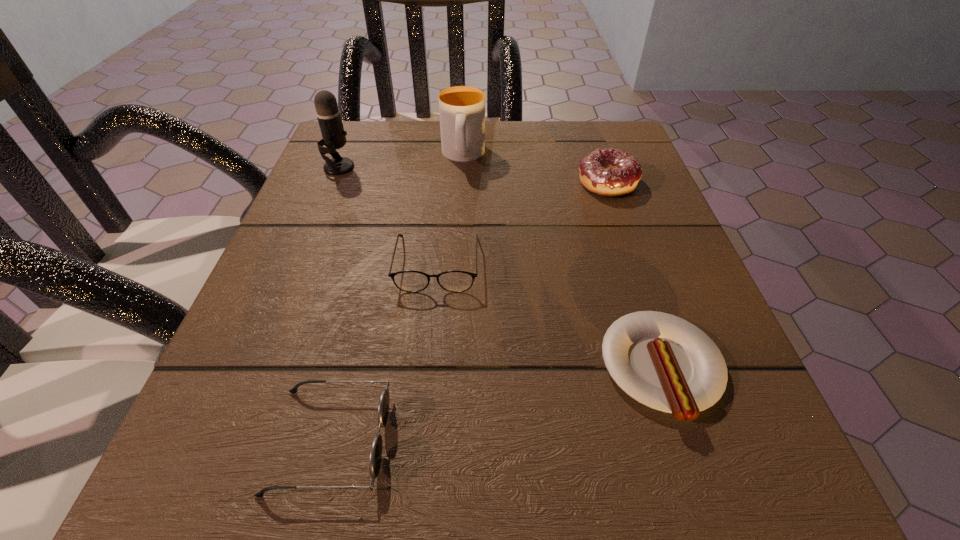
Where is `microphone`? This screenshot has height=540, width=960. microphone is located at coordinates (328, 114).

Identify the location of the tallest object. (328, 114).

This screenshot has width=960, height=540. Find the location of `cup`. cup is located at coordinates (461, 108).

The height and width of the screenshot is (540, 960). Identify the location of doughnut. (608, 172).

Where is `spectacles`? This screenshot has width=960, height=540. spectacles is located at coordinates (412, 281).

The image size is (960, 540). What are the coordinates of `sunglasses` in the screenshot? It's located at (375, 458).

Image resolution: width=960 pixels, height=540 pixels. What are the coordinates of `sausage` in the screenshot? It's located at (662, 361).

The image size is (960, 540). Identify the location of free location located 0.140m on the right of the leftmost object. (423, 167).

I want to click on blank space located 0.240m with the handle on the side of the cup, so coord(458,259).

Where is `vacant space located 0.190m on the left of the doughnut`? vacant space located 0.190m on the left of the doughnut is located at coordinates (479, 183).